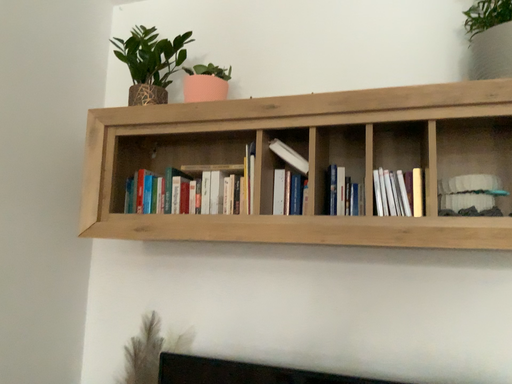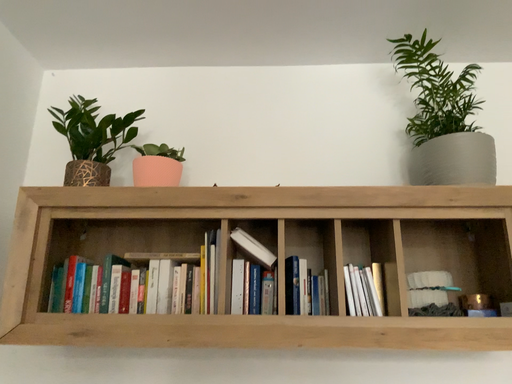
Question: Which way did the camera rotate in the video?

Choices:
 (A) rotated upward
 (B) rotated downward

Answer: (A)